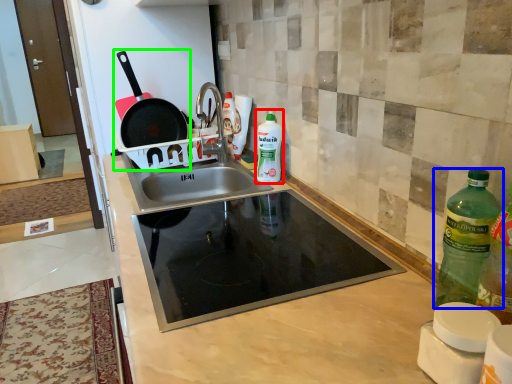
Question: Considering the real-world distances, which object is farthest from bottle (highlighted by a red box)? bottle (highlighted by a blue box) or frying pan (highlighted by a green box)?

Choices:
 (A) bottle
 (B) frying pan

Answer: (A)